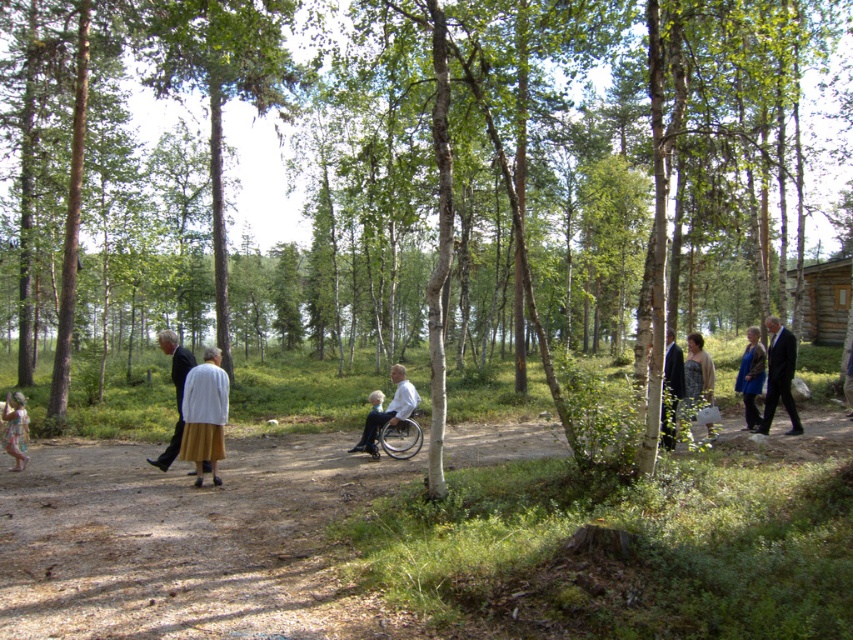
Is dark blue suit at center positioned before silver metallic wheelchair at center?

No, it is behind silver metallic wheelchair at center.

How distant is dark blue suit at center from silver metallic wheelchair at center?

A distance of 6.19 meters exists between dark blue suit at center and silver metallic wheelchair at center.

The width and height of the screenshot is (853, 640). Find the location of `dark blue suit at center`. dark blue suit at center is located at coordinates (751, 376).

Is dark blue suit at right wider than dark gray wool coat at right?

Yes, dark blue suit at right is wider than dark gray wool coat at right.

Is point (664, 429) farther from camera compared to point (697, 378)?

No, (664, 429) is in front of (697, 378).

Is point (675, 392) positioned behind point (686, 403)?

That is True.

Find the location of a particular element. This screenshot has width=853, height=640. dark blue suit at right is located at coordinates (671, 388).

Identify the location of dark gray wool coat at right. (697, 371).

Which is in front, point (706, 378) or point (16, 435)?

Point (16, 435)

Where is `dark gray wool coat at right`? This screenshot has width=853, height=640. dark gray wool coat at right is located at coordinates (697, 371).